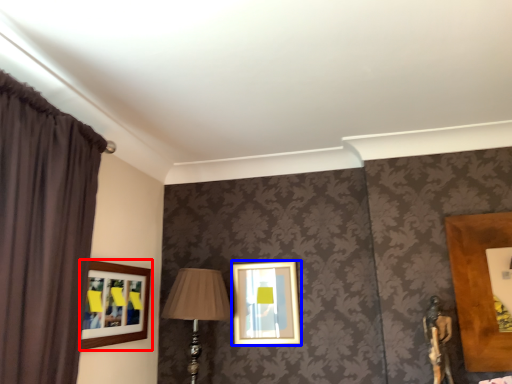
Question: Which object is closer to the camera taking this photo, picture frame (highlighted by a red box) or picture frame (highlighted by a blue box)?

Choices:
 (A) picture frame
 (B) picture frame

Answer: (A)